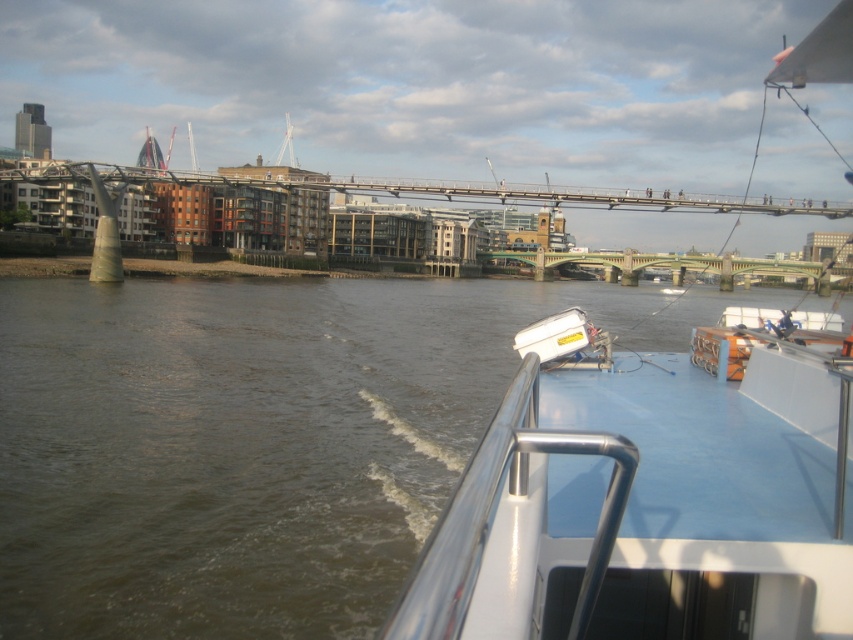
Does white plastic boat at center appear on the left side of green metallic bridge at center?

Yes, white plastic boat at center is to the left of green metallic bridge at center.

Between point (712, 627) and point (625, 260), which one is positioned behind?

Point (625, 260)

Does point (828, 536) come farther from viewer compared to point (611, 257)?

No, (828, 536) is in front of (611, 257).

Where is `white plastic boat at center`? white plastic boat at center is located at coordinates (651, 500).

In the scene shown: Is brown water at lower left taller than green metallic bridge at center?

No, brown water at lower left is not taller than green metallic bridge at center.

Who is more forward, (125, 625) or (697, 264)?

Point (125, 625) is in front.

Who is more distant from viewer, (276, 500) or (838, 272)?

The point (838, 272) is more distant.

Identify the location of brown water at lower left. (242, 440).

Who is lower down, brown water at lower left or white plastic boat at center?

white plastic boat at center is lower down.

Consider the image. Between brown water at lower left and white plastic boat at center, which one has less height?

brown water at lower left

Between point (292, 515) and point (817, 580), which one is positioned in front?

Point (817, 580)

You are a GUI agent. You are given a task and a screenshot of the screen. Output one action in this format:
    pyautogui.click(x=<x>, y=<y>)
    Task: Click on the brown water at lower left
    The height and width of the screenshot is (640, 853).
    Given the screenshot: What is the action you would take?
    pyautogui.click(x=242, y=440)